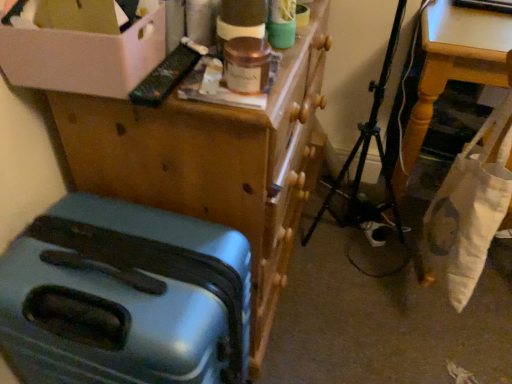
Question: Is wooden table at lower right further to camera compared to teal plastic suitcase at lower left?

Choices:
 (A) no
 (B) yes

Answer: (B)

Question: Considering the relative sizes of wooden table at lower right and teal plastic suitcase at lower left in the image provided, is wooden table at lower right wider than teal plastic suitcase at lower left?

Choices:
 (A) yes
 (B) no

Answer: (A)

Question: Considering the relative sizes of wooden table at lower right and teal plastic suitcase at lower left in the image provided, is wooden table at lower right thinner than teal plastic suitcase at lower left?

Choices:
 (A) no
 (B) yes

Answer: (A)

Question: Does wooden table at lower right come in front of teal plastic suitcase at lower left?

Choices:
 (A) yes
 (B) no

Answer: (B)

Question: From a real-world perspective, is wooden table at lower right physically below teal plastic suitcase at lower left?

Choices:
 (A) yes
 (B) no

Answer: (A)

Question: Is white fabric bag at lower right taller or shorter than wooden table at lower right?

Choices:
 (A) short
 (B) tall

Answer: (B)

Question: In terms of width, does white fabric bag at lower right look wider or thinner when compared to wooden table at lower right?

Choices:
 (A) wide
 (B) thin

Answer: (B)

Question: From a real-world perspective, is white fabric bag at lower right above or below wooden table at lower right?

Choices:
 (A) below
 (B) above

Answer: (B)

Question: Considering their positions, is white fabric bag at lower right located in front of or behind wooden table at lower right?

Choices:
 (A) front
 (B) behind

Answer: (A)

Question: Looking at the image, does teal plastic suitcase at lower left seem bigger or smaller compared to white cardboard box at upper left?

Choices:
 (A) small
 (B) big

Answer: (B)

Question: Is teal plastic suitcase at lower left wider or thinner than white cardboard box at upper left?

Choices:
 (A) wide
 (B) thin

Answer: (A)

Question: From a real-world perspective, is teal plastic suitcase at lower left physically located above or below white cardboard box at upper left?

Choices:
 (A) below
 (B) above

Answer: (A)

Question: In terms of height, does teal plastic suitcase at lower left look taller or shorter compared to white cardboard box at upper left?

Choices:
 (A) short
 (B) tall

Answer: (B)

Question: From a real-world perspective, relative to metallic blue suitcase at lower left, is white fabric bag at lower right vertically above or below?

Choices:
 (A) above
 (B) below

Answer: (A)

Question: Considering their positions, is white fabric bag at lower right located in front of or behind metallic blue suitcase at lower left?

Choices:
 (A) front
 (B) behind

Answer: (B)